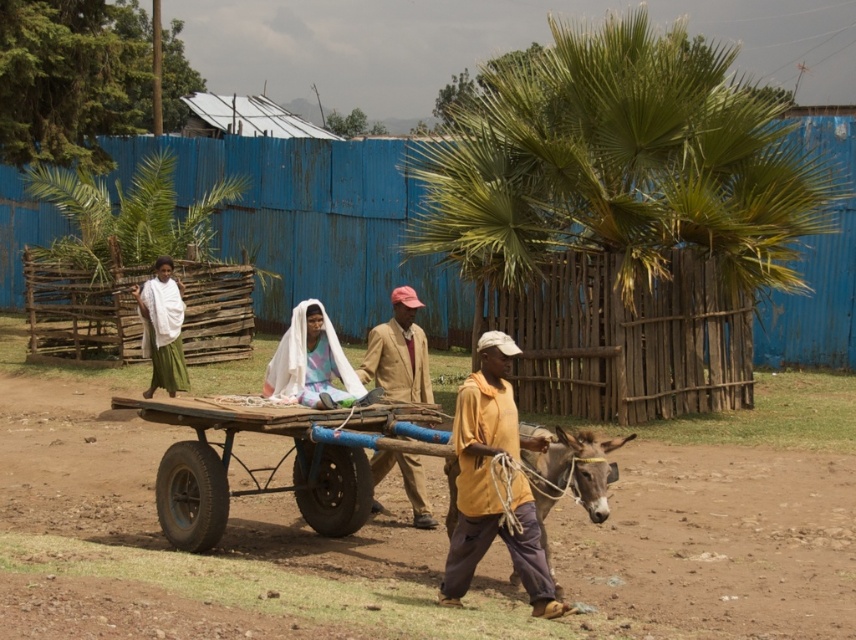
Question: Observing the image, what is the correct spatial positioning of brown leather mule at center in reference to white sheer cloth at center?

Choices:
 (A) below
 (B) above

Answer: (A)

Question: Is white sheer cloth at center thinner than white cloth at center?

Choices:
 (A) yes
 (B) no

Answer: (A)

Question: Among these points, which one is nearest to the camera?

Choices:
 (A) (308, 300)
 (B) (441, 445)
 (C) (771, 179)
 (D) (421, 634)

Answer: (D)

Question: Estimate the real-world distances between objects in this image. Which object is farther from the brown dirt field at center?

Choices:
 (A) yellow matte shirt at center
 (B) beige fabric jacket at center
 (C) white sheer cloth at center
 (D) brown leather mule at center

Answer: (C)

Question: Can you confirm if yellow matte shirt at center is bigger than brown leather mule at center?

Choices:
 (A) yes
 (B) no

Answer: (A)

Question: Among these objects, which one is nearest to the camera?

Choices:
 (A) white cloth at center
 (B) yellow matte shirt at center
 (C) white sheer cloth at center
 (D) wooden cart at center

Answer: (B)